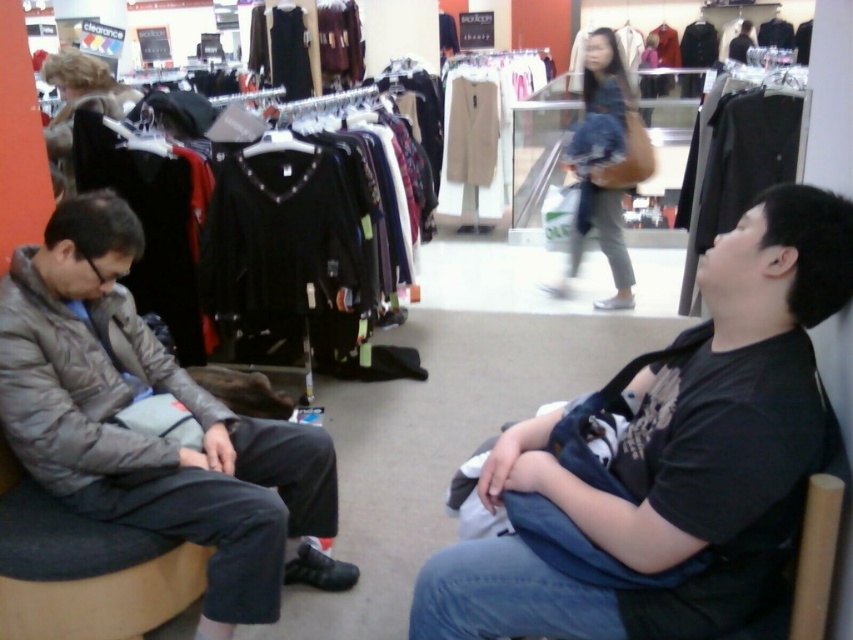
Locate an element on the screen. The width and height of the screenshot is (853, 640). black cotton shirt at right is located at coordinates (666, 460).

Who is positioned more to the left, black cotton shirt at right or gray quilted jacket at left?

From the viewer's perspective, gray quilted jacket at left appears more on the left side.

Image resolution: width=853 pixels, height=640 pixels. Find the location of `black cotton shirt at right`. black cotton shirt at right is located at coordinates (666, 460).